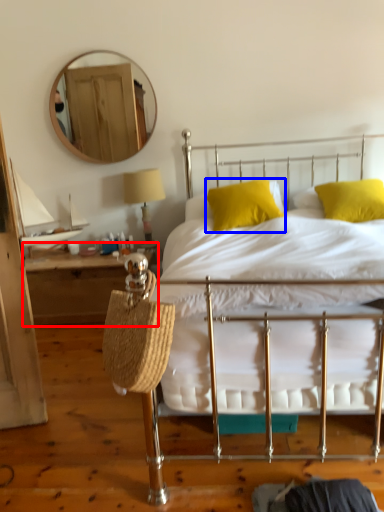
Question: Which object appears farthest to the camera in this image, nightstand (highlighted by a red box) or pillow (highlighted by a blue box)?

Choices:
 (A) nightstand
 (B) pillow

Answer: (A)